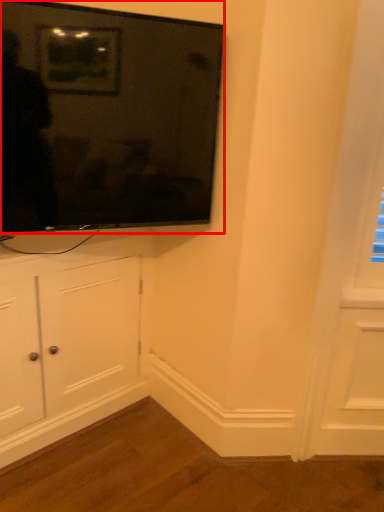
Question: Where is television (annotated by the red box) located in relation to cabinetry in the image?

Choices:
 (A) right
 (B) left

Answer: (A)